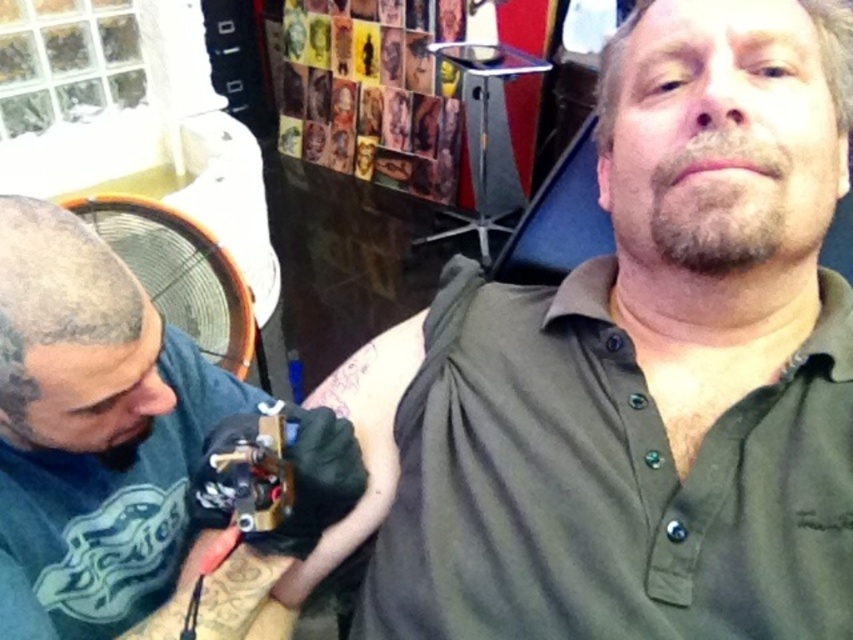
Question: Which point is farther to the camera?

Choices:
 (A) green matte shirt at upper right
 (B) black matte tattoo gun at left

Answer: (B)

Question: Is green matte shirt at upper right thinner than black matte tattoo gun at left?

Choices:
 (A) yes
 (B) no

Answer: (B)

Question: Can you confirm if green matte shirt at upper right is positioned below black matte tattoo gun at left?

Choices:
 (A) no
 (B) yes

Answer: (A)

Question: Does green matte shirt at upper right appear over black matte tattoo gun at left?

Choices:
 (A) yes
 (B) no

Answer: (A)